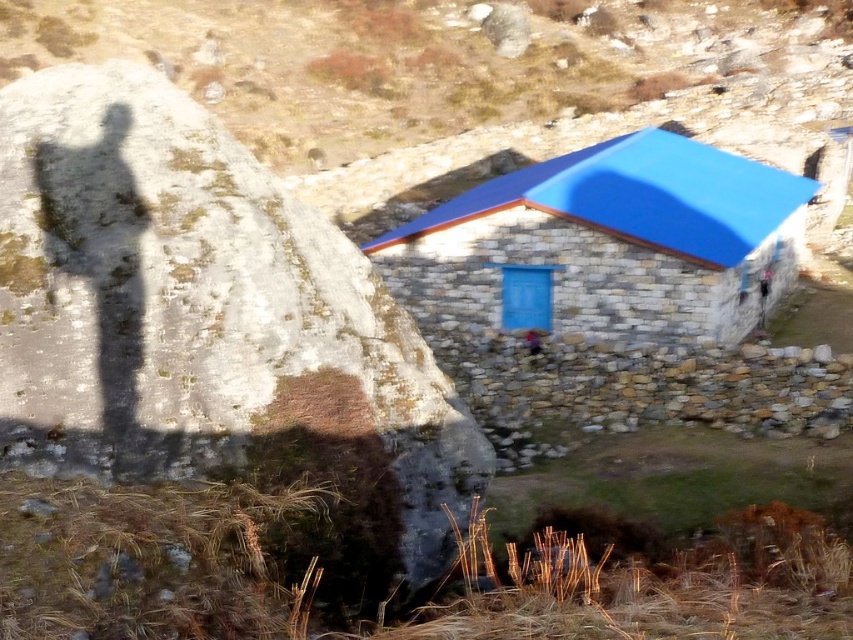
Is rusty stone boulder at left positioned before blue stone hut at center?

That is True.

Is rusty stone boulder at left taller than blue stone hut at center?

Incorrect, rusty stone boulder at left's height is not larger of blue stone hut at center's.

Locate an element on the screen. This screenshot has height=640, width=853. rusty stone boulder at left is located at coordinates (206, 317).